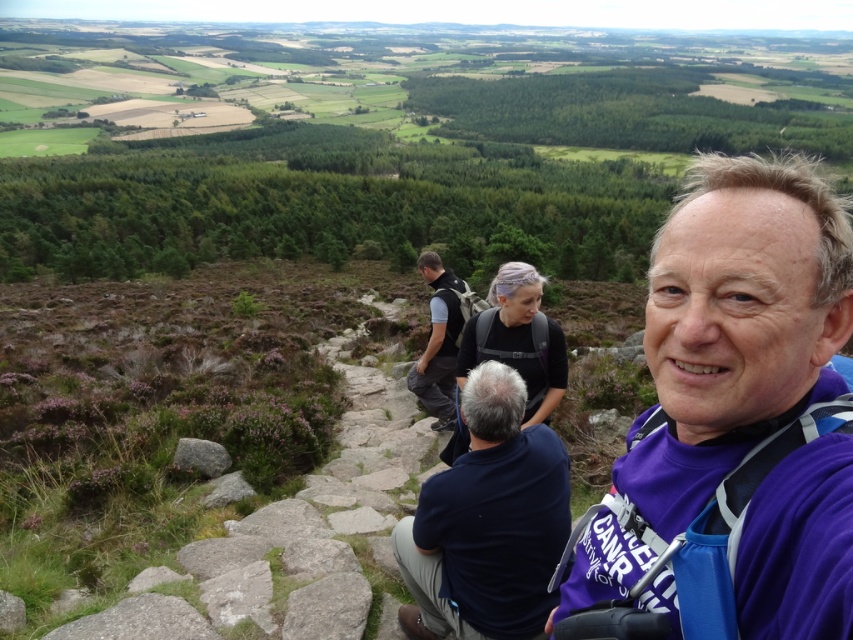
Question: Does purple fabric at center lie in front of gray rough rock at lower left?

Choices:
 (A) no
 (B) yes

Answer: (B)

Question: Is dark blue shirt at center to the left of gray rough rock at lower left from the viewer's perspective?

Choices:
 (A) no
 (B) yes

Answer: (A)

Question: Which point is closer to the camera?

Choices:
 (A) dark gray fabric backpack at center
 (B) gray rough rock at lower left
 (C) purple fabric at center
 (D) dark blue shirt at center

Answer: (C)

Question: Is dark gray fabric backpack at center positioned behind gray rough rock at lower left?

Choices:
 (A) yes
 (B) no

Answer: (A)

Question: Which point is closer to the camera?

Choices:
 (A) gray rough rock at lower left
 (B) dark blue shirt at center
 (C) purple fabric at center
 (D) dark gray fabric backpack at center

Answer: (C)

Question: Among these objects, which one is nearest to the camera?

Choices:
 (A) purple fabric at center
 (B) dark blue shirt at center

Answer: (A)